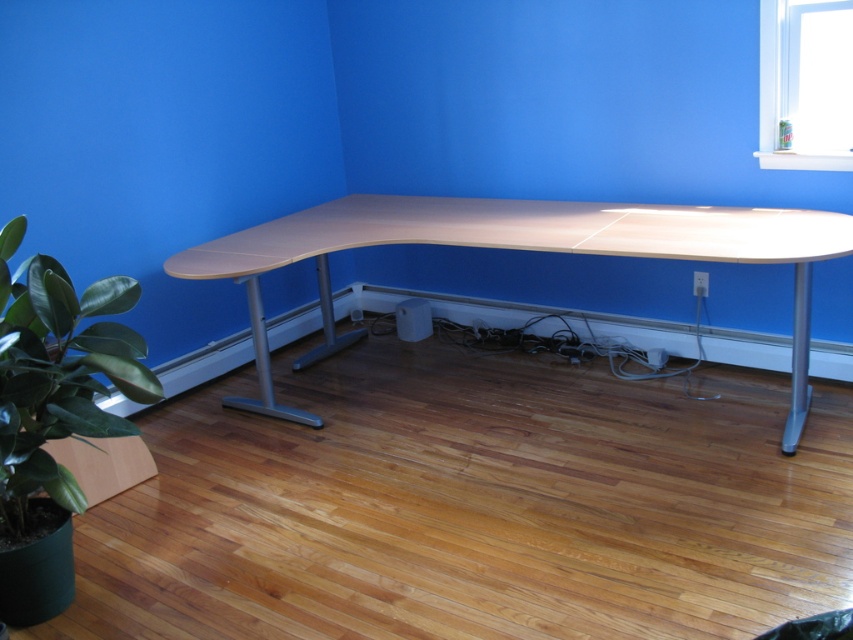
Question: Which point appears closest to the camera in this image?

Choices:
 (A) (816, 12)
 (B) (19, 428)
 (C) (346, 228)

Answer: (B)

Question: Can you confirm if light wood/wooden table at center is wider than green rubbery plant at lower left?

Choices:
 (A) yes
 (B) no

Answer: (A)

Question: Which object is the closest to the clear glass window at upper right?

Choices:
 (A) green rubbery plant at lower left
 (B) light wood/wooden table at center

Answer: (B)

Question: Is light wood/wooden table at center thinner than clear glass window at upper right?

Choices:
 (A) no
 (B) yes

Answer: (A)

Question: Which point appears farthest from the camera in this image?

Choices:
 (A) (427, 220)
 (B) (49, 401)
 (C) (798, 90)

Answer: (A)

Question: Is green rubbery plant at lower left wider than clear glass window at upper right?

Choices:
 (A) no
 (B) yes

Answer: (B)